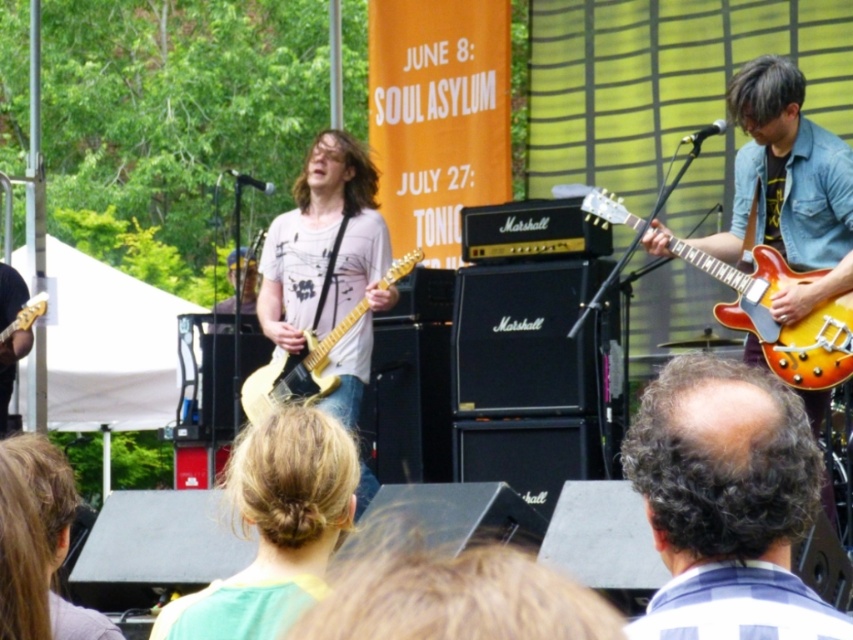
Question: Among these objects, which one is farthest from the camera?

Choices:
 (A) matte yellow guitar at right
 (B) blonde hair at center
 (C) sunburst wood electric guitar at right
 (D) dark brown curly hair at center

Answer: (A)

Question: Is the position of blonde hair at center less distant than that of matte gold electric guitar at center?

Choices:
 (A) yes
 (B) no

Answer: (A)

Question: Which object is closer to the camera taking this photo?

Choices:
 (A) matte gold electric guitar at center
 (B) dark brown curly hair at center
 (C) sunburst wood electric guitar at right
 (D) blonde hair at center

Answer: (B)

Question: Estimate the real-world distances between objects in this image. Which object is closer to the sunburst wood electric guitar at right?

Choices:
 (A) blonde hair at center
 (B) matte gold electric guitar at center

Answer: (B)

Question: Observing the image, what is the correct spatial positioning of matte yellow guitar at right in reference to matte gold electric guitar at center?

Choices:
 (A) left
 (B) right

Answer: (B)

Question: Is blonde hair at center positioned at the back of sunburst wood electric guitar at right?

Choices:
 (A) yes
 (B) no

Answer: (B)